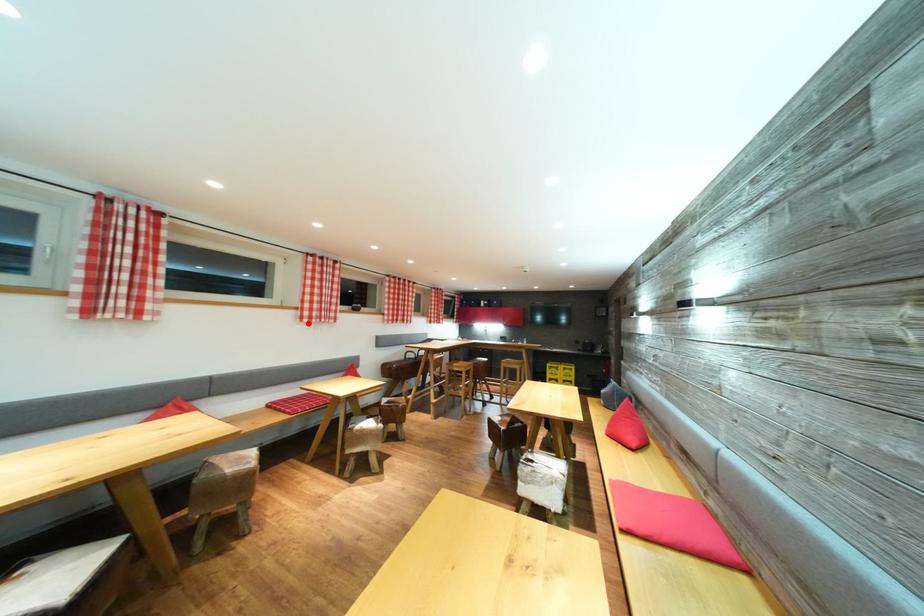
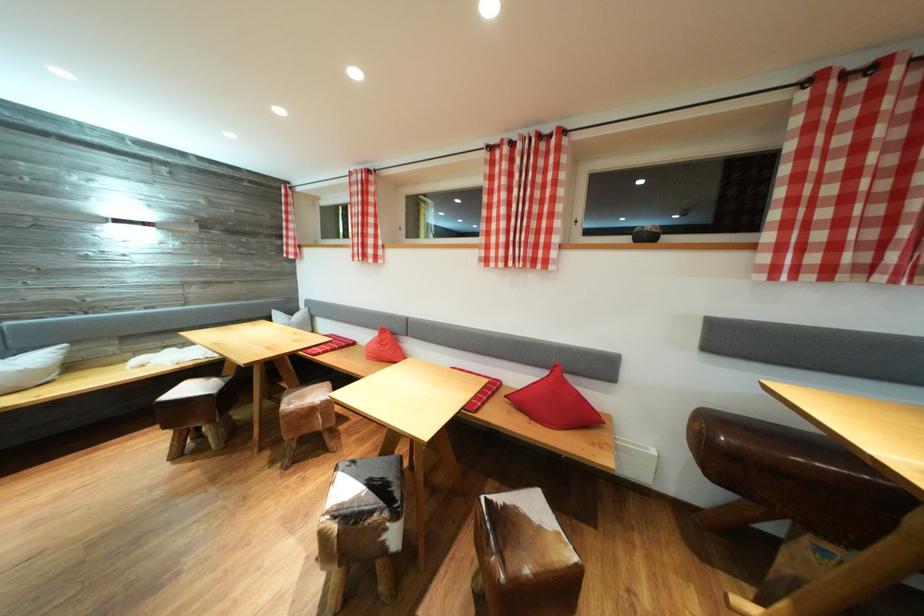
Find the pixel in the second image that matches the highlighted location in the first image.

(492, 265)